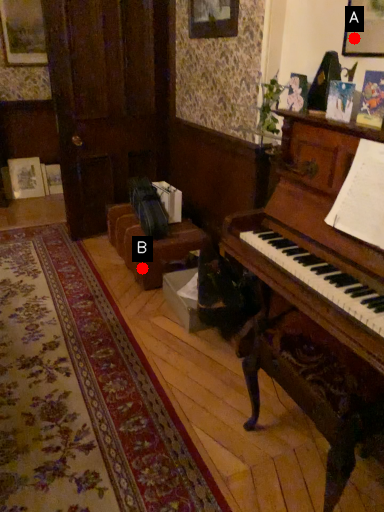
Question: Two points are circled on the image, labeled by A and B beside each circle. Which point is closer to the camera taking this photo?

Choices:
 (A) A is closer
 (B) B is closer

Answer: (A)